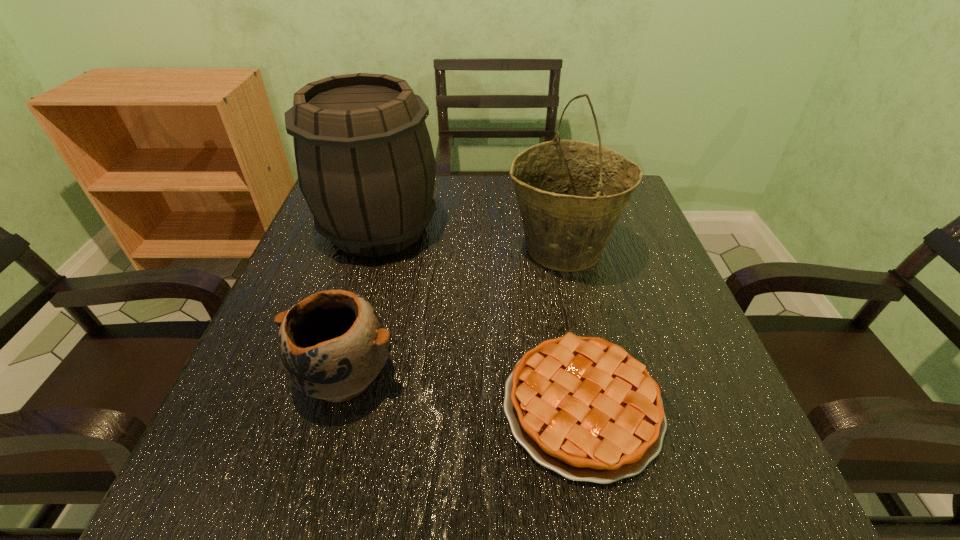
Locate an element on the screen. pottery at the left edge is located at coordinates (332, 344).

Find the location of `wine bucket located in the right edge section of the desktop`. wine bucket located in the right edge section of the desktop is located at coordinates (571, 194).

Locate an element on the screen. pie that is positioned at the right edge is located at coordinates (583, 407).

Image resolution: width=960 pixels, height=540 pixels. In order to click on object that is at the far left corner in this screenshot , I will do `click(365, 163)`.

In order to click on object that is at the far right corner in this screenshot , I will do `click(571, 194)`.

At what (x,y) coordinates should I click in order to perform the action: click on object at the near right corner. Please return your answer as a coordinate pair (x, y). Image resolution: width=960 pixels, height=540 pixels. Looking at the image, I should click on coord(583,407).

Identify the location of free space at the far edge of the desktop. (508, 219).

This screenshot has width=960, height=540. In order to click on vacant area at the left edge in this screenshot , I will do `click(360, 291)`.

Locate an element on the screen. This screenshot has width=960, height=540. free space at the right edge is located at coordinates (645, 336).

Where is `vacant space at the near right corner of the desktop`? vacant space at the near right corner of the desktop is located at coordinates (707, 448).